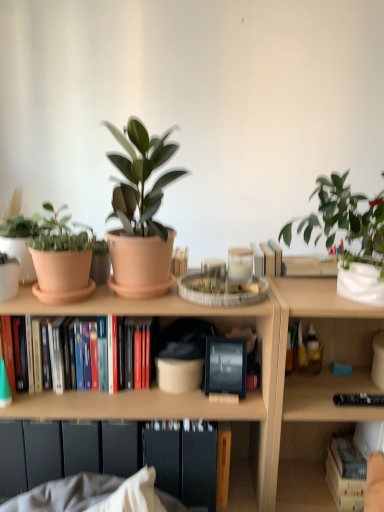
Question: In terms of width, does hardcover book at lower right, placed as the second book when sorted from top to bottom, look wider or thinner when compared to wooden bookcase at center?

Choices:
 (A) thin
 (B) wide

Answer: (A)

Question: From a real-world perspective, is hardcover book at lower right, the 1th book in the right-to-left sequence, above or below wooden bookcase at center?

Choices:
 (A) below
 (B) above

Answer: (A)

Question: Which of these objects is positioned closest to the white glossy pot at upper right, marked as the first houseplant in a right-to-left arrangement?

Choices:
 (A) hardcover books at center left, acting as the 2th book starting from the right
 (B) matte black cabinet at lower center
 (C) white matte vase at upper right, the 1th flowerpot positioned from the right
 (D) hardcover book at lower right, positioned as the second book in left-to-right order
 (E) wooden bookcase at center

Answer: (C)

Question: Which is farther from the matte terracotta pot at center, which appears as the second houseplant when viewed from the back?

Choices:
 (A) white glossy pot at upper right, the 1th houseplant positioned from the back
 (B) terracotta clay pot at left, marked as the second flowerpot in a right-to-left arrangement
 (C) matte black cabinet at lower center
 (D) hardcover book at lower right, marked as the 1th book in a bottom-to-top arrangement
 (E) hardcover books at center left, acting as the 2th book starting from the right

Answer: (D)